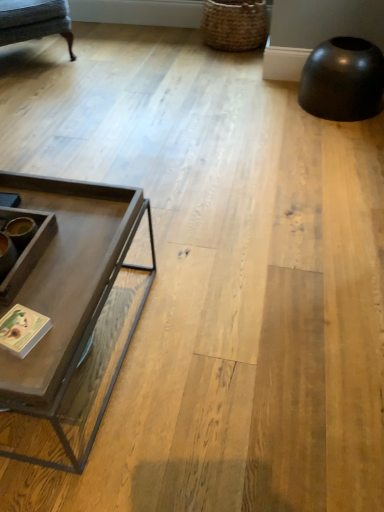
Locate an element on the screen. Image resolution: width=384 pixels, height=512 pixels. vacant area that is situated to the right of matte gray coffee table at left is located at coordinates (227, 339).